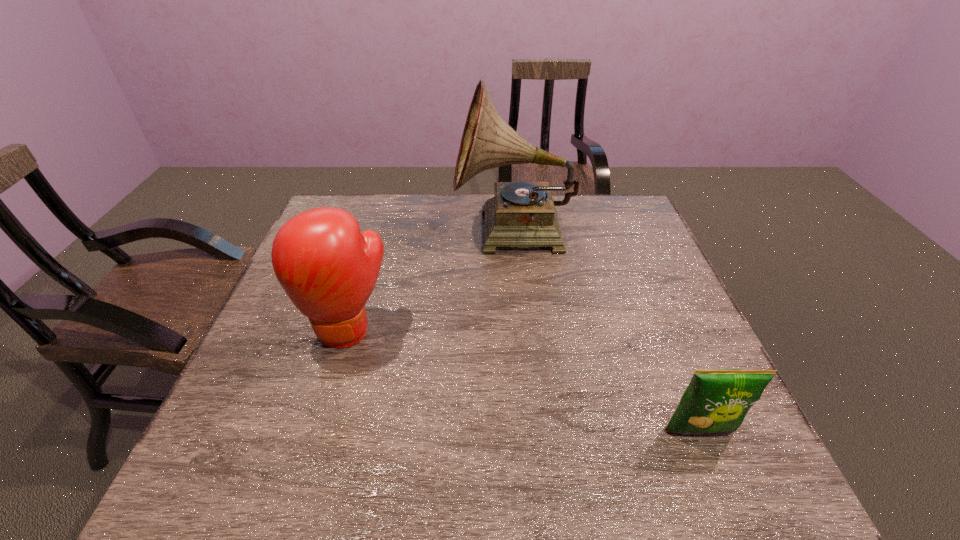
Locate an element on the screen. This screenshot has height=540, width=960. empty space between the shortest object and the tallest object is located at coordinates (607, 332).

Identify the location of free spot between the boxing glove and the tallest object. The width and height of the screenshot is (960, 540). (431, 281).

You are a GUI agent. You are given a task and a screenshot of the screen. Output one action in this format:
    pyautogui.click(x=<x>, y=<y>)
    Task: Click on the vacant point located between the second nearest object and the second object from left to right
    Image resolution: width=960 pixels, height=540 pixels.
    Given the screenshot: What is the action you would take?
    pyautogui.click(x=431, y=281)

You are a GUI agent. You are given a task and a screenshot of the screen. Output one action in this format:
    pyautogui.click(x=<x>, y=<y>)
    Task: Click on the free space between the crisp (potato chip) and the tallest object
    This screenshot has width=960, height=540.
    Given the screenshot: What is the action you would take?
    pyautogui.click(x=607, y=332)

Identify the location of vacant area between the tallest object and the leftmost object. (431, 281).

Locate an element on the screen. This screenshot has height=540, width=960. vacant area that lies between the rightmost object and the tallest object is located at coordinates (607, 332).

At what (x,y) coordinates should I click in order to perform the action: click on free spot between the tallest object and the crisp (potato chip). Please return your answer as a coordinate pair (x, y). The height and width of the screenshot is (540, 960). Looking at the image, I should click on (607, 332).

Identify the location of empty space that is in between the rightmost object and the tallest object. (607, 332).

Where is `free space between the rightmost object and the boxing glove`? Image resolution: width=960 pixels, height=540 pixels. free space between the rightmost object and the boxing glove is located at coordinates (524, 380).

Where is `free point between the tallest object and the crisp (potato chip)`? Image resolution: width=960 pixels, height=540 pixels. free point between the tallest object and the crisp (potato chip) is located at coordinates (607, 332).